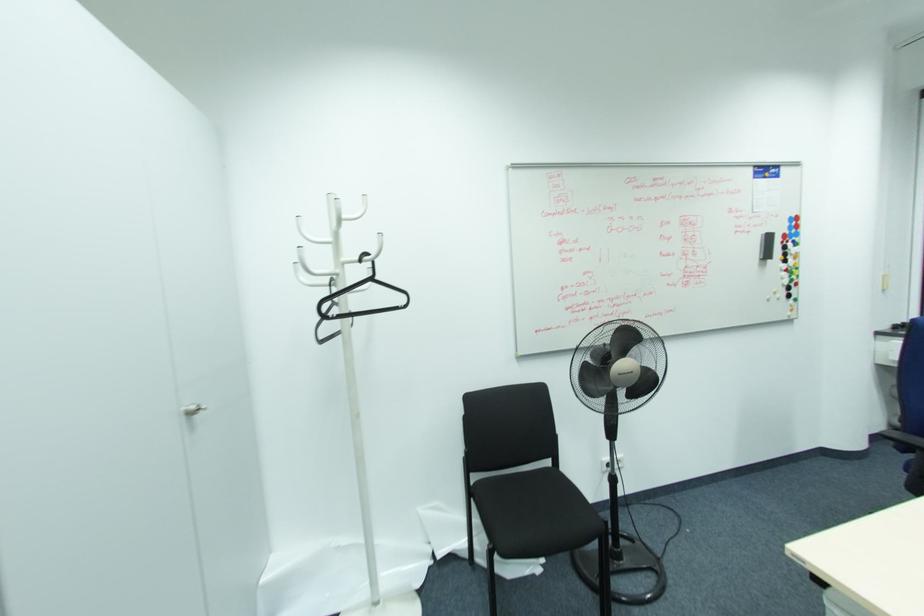
Where would you turn the silver door handle? Please return your answer as a coordinate pair (x, y).

(192, 408)